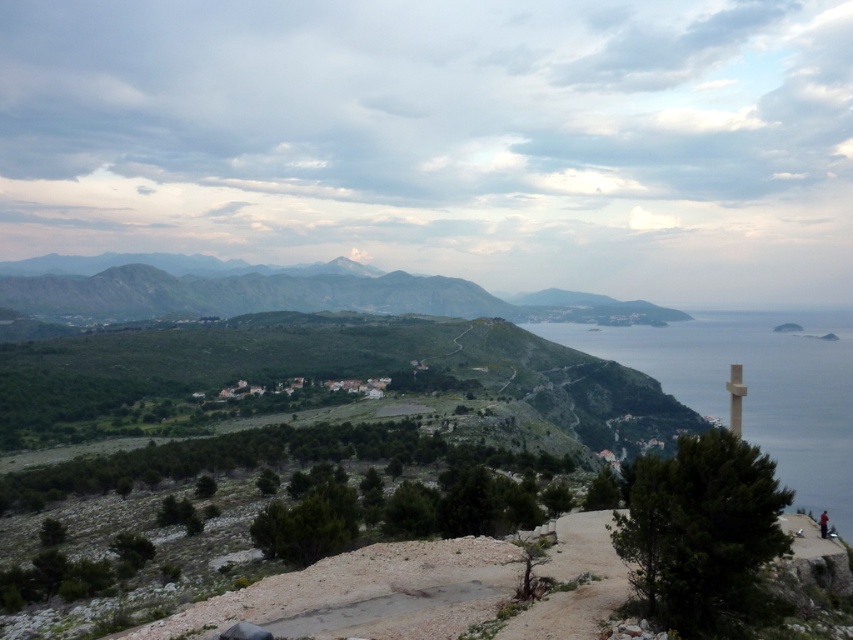
Can you confirm if green grassy hill at left is taller than dark red fabric at lower right?

Yes, green grassy hill at left is taller than dark red fabric at lower right.

Describe the element at coordinates (289, 292) in the screenshot. The height and width of the screenshot is (640, 853). I see `green grassy hill at left` at that location.

Image resolution: width=853 pixels, height=640 pixels. Identify the location of green grassy hill at left. (289, 292).

Locate an element on the screen. green grassy hill at left is located at coordinates coord(289,292).

Looking at this image, can you confirm if blue water at right is smaller than dark red fabric at lower right?

No.

Locate an element on the screen. Image resolution: width=853 pixels, height=640 pixels. blue water at right is located at coordinates (753, 387).

Is point (824, 424) positioned in front of point (822, 515)?

No, it is not.

Locate an element on the screen. blue water at right is located at coordinates (753, 387).

Who is more distant from viewer, (720, 340) or (105, 285)?

Positioned behind is point (105, 285).

Looking at this image, is blue water at right to the left of green grassy hill at left from the viewer's perspective?

In fact, blue water at right is to the right of green grassy hill at left.

Does point (708, 352) come behind point (550, 316)?

No, (708, 352) is closer to viewer.

This screenshot has height=640, width=853. Find the location of `blue water at right`. blue water at right is located at coordinates coord(753,387).